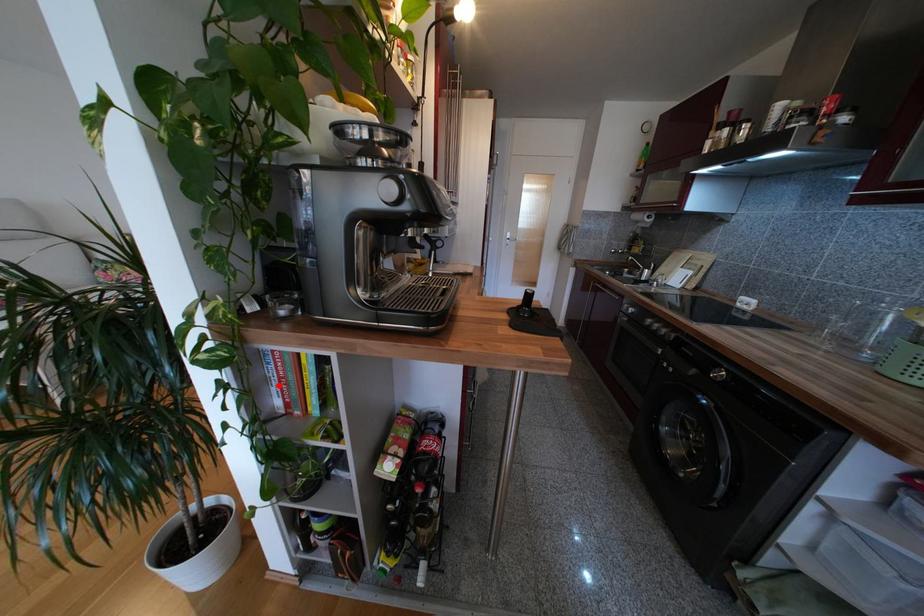
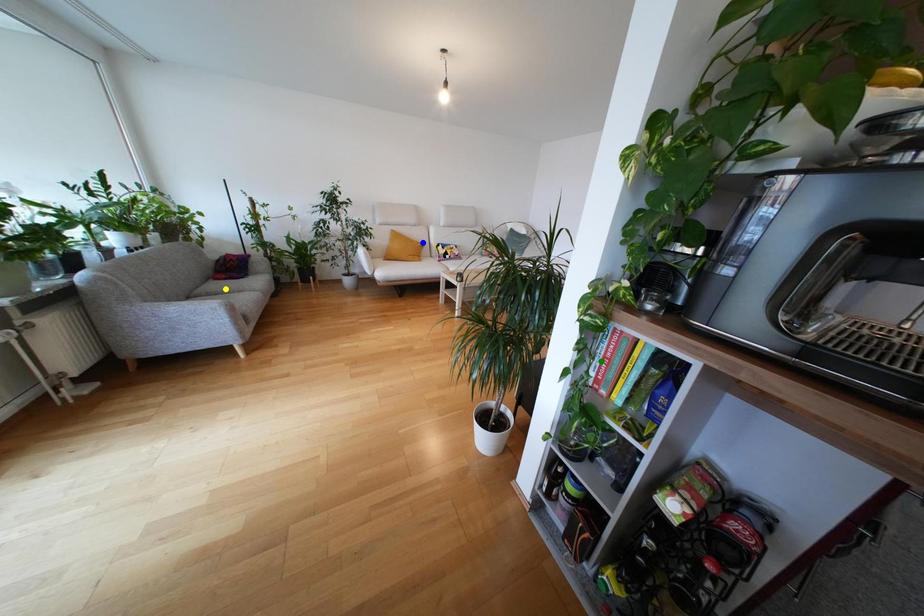
Question: I am providing you with two images of the same scene from different viewpoints. A red point is marked on the first image. You are given multiple points on the second image. Can you choose the point in image 2 that corresponds to the point in image 1?

Choices:
 (A) yellow point
 (B) blue point
 (C) green point

Answer: (C)